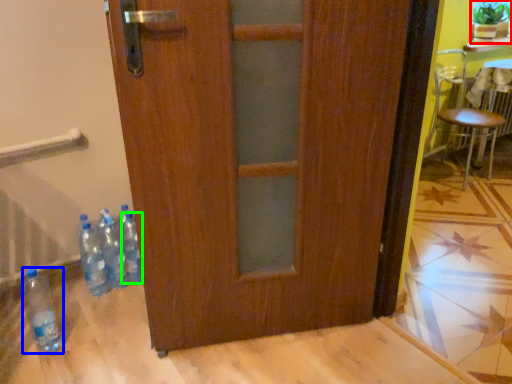
Question: Which object is the closest to the houseplant (highlighted by a red box)? Choose among these: bottle (highlighted by a blue box) or bottle (highlighted by a green box).

Choices:
 (A) bottle
 (B) bottle

Answer: (B)